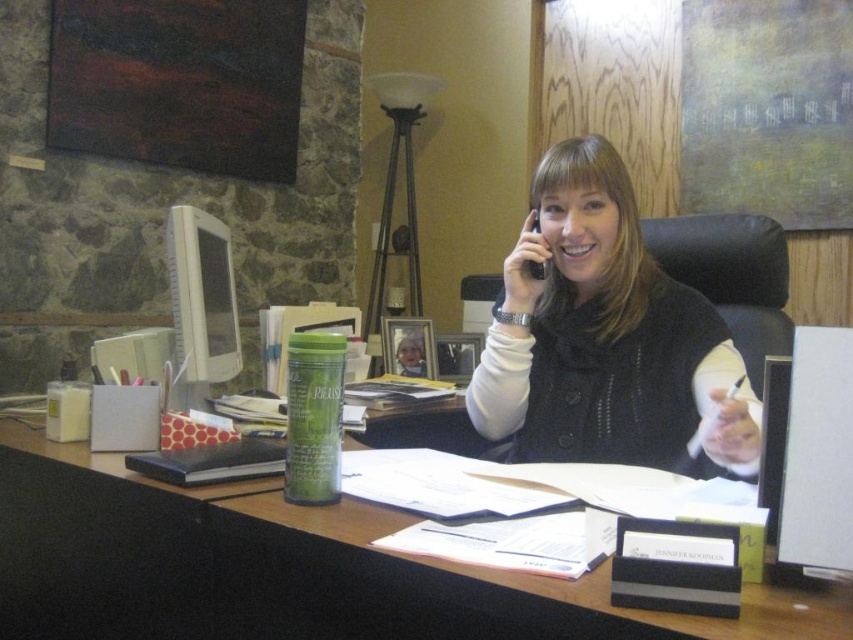
Question: From the image, what is the correct spatial relationship of wooden desk at center in relation to matte black vest at center?

Choices:
 (A) below
 (B) above

Answer: (A)

Question: Among these objects, which one is farthest from the camera?

Choices:
 (A) wooden desk at center
 (B) black plastic phone at upper center

Answer: (B)

Question: Which object is positioned farthest from the black plastic phone at upper center?

Choices:
 (A) wooden desk at center
 (B) matte black vest at center

Answer: (A)

Question: Does wooden desk at center appear on the right side of matte black vest at center?

Choices:
 (A) yes
 (B) no

Answer: (B)

Question: Which of the following is the closest to the observer?

Choices:
 (A) matte black vest at center
 (B) black plastic phone at upper center

Answer: (A)

Question: Is the position of wooden desk at center less distant than that of matte black vest at center?

Choices:
 (A) no
 (B) yes

Answer: (B)